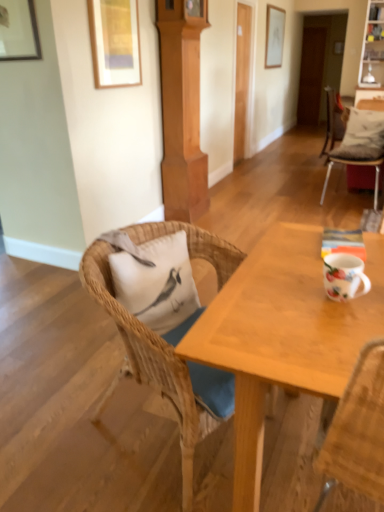
How much space does white cushioned chair at right, which is counted as the second chair, starting from the left, occupy horizontally?

24.19 inches.

Find the location of a particular element. This screenshot has width=384, height=512. white cushioned chair at right, which is the 2th chair from front to back is located at coordinates pos(357,163).

Where is `white matte pillow at left, the first pillow positioned from the left`? This screenshot has width=384, height=512. white matte pillow at left, the first pillow positioned from the left is located at coordinates (157, 282).

In order to click on matte white picture frame at upper center, which is counted as the 3th picture frame, starting from the front in this screenshot , I will do `click(274, 36)`.

The width and height of the screenshot is (384, 512). What are the coordinates of `white glossy mug at right` in the screenshot? It's located at (344, 276).

This screenshot has width=384, height=512. I want to click on white cushioned chair at right, the first chair positioned from the back, so click(x=357, y=163).

Considering the relative sizes of woven wood chair at center, positioned as the second chair in top-to-bottom order, and white glossy mug at right in the image provided, is woven wood chair at center, positioned as the second chair in top-to-bottom order, smaller than white glossy mug at right?

Incorrect, woven wood chair at center, positioned as the second chair in top-to-bottom order, is not smaller in size than white glossy mug at right.

From a real-world perspective, which chair is the 2nd one underneath the white glossy mug at right? Please provide its 2D coordinates.

[(164, 364)]

Does point (233, 255) come in front of point (342, 253)?

No.

From the image's perspective, is matte white picture frame at upper center, the third picture frame when ordered from bottom to top, above or below white fabric pillow at upper right, which appears as the second pillow when viewed from the front?

Clearly, from the image's perspective, matte white picture frame at upper center, the third picture frame when ordered from bottom to top, is above white fabric pillow at upper right, which appears as the second pillow when viewed from the front.

In the scene shown: Is there a large distance between matte white picture frame at upper center, which is counted as the 3th picture frame, starting from the front, and white fabric pillow at upper right, the second pillow positioned from the left?

Yes.

From a real-world perspective, between matte white picture frame at upper center, which ranks as the 3th picture frame in left-to-right order, and white fabric pillow at upper right, the second pillow positioned from the left, who is vertically lower?

In real-world perspective, white fabric pillow at upper right, the second pillow positioned from the left, is lower.

How much distance is there between matte white picture frame at upper center, which ranks as the 3th picture frame in left-to-right order, and white fabric pillow at upper right, placed as the 2th pillow when sorted from bottom to top?

10.44 feet.

Can we say white fabric pillow at upper right, which is counted as the first pillow, starting from the right, lies outside wooden picture frame at upper left, the 3th picture frame in the top-to-bottom sequence?

Yes, white fabric pillow at upper right, which is counted as the first pillow, starting from the right, is located beyond the bounds of wooden picture frame at upper left, the 3th picture frame in the top-to-bottom sequence.

Considering the sizes of white fabric pillow at upper right, which is counted as the first pillow, starting from the right, and wooden picture frame at upper left, acting as the first picture frame starting from the bottom, in the image, is white fabric pillow at upper right, which is counted as the first pillow, starting from the right, wider or thinner than wooden picture frame at upper left, acting as the first picture frame starting from the bottom,?

Clearly, white fabric pillow at upper right, which is counted as the first pillow, starting from the right, has more width compared to wooden picture frame at upper left, acting as the first picture frame starting from the bottom.

Is white fabric pillow at upper right, positioned as the 1th pillow in top-to-bottom order, looking in the opposite direction of wooden picture frame at upper left, acting as the first picture frame starting from the bottom?

white fabric pillow at upper right, positioned as the 1th pillow in top-to-bottom order, is not turned away from wooden picture frame at upper left, acting as the first picture frame starting from the bottom.

From a real-world perspective, which object rests below the other?

white fabric pillow at upper right, which appears as the second pillow when viewed from the front, is physically lower.

Is there a large distance between matte wooden picture frame at upper left, which is the second picture frame from left to right, and white cushioned chair at right, the first chair when ordered from right to left?

Yes, matte wooden picture frame at upper left, which is the second picture frame from left to right, is far from white cushioned chair at right, the first chair when ordered from right to left.

From the image's perspective, who appears lower, matte wooden picture frame at upper left, arranged as the second picture frame when viewed from the right, or white cushioned chair at right, which is the 2th chair from front to back?

From the image's view, white cushioned chair at right, which is the 2th chair from front to back, is below.

Would you say white cushioned chair at right, which is counted as the 2th chair, starting from the bottom, is part of matte wooden picture frame at upper left, the 2th picture frame viewed from the top,'s contents?

No, matte wooden picture frame at upper left, the 2th picture frame viewed from the top, does not contain white cushioned chair at right, which is counted as the 2th chair, starting from the bottom.

Does matte wooden picture frame at upper left, arranged as the second picture frame when viewed from the right, appear on the left side of white fabric pillow at upper right, positioned as the 1th pillow in top-to-bottom order?

Indeed, matte wooden picture frame at upper left, arranged as the second picture frame when viewed from the right, is positioned on the left side of white fabric pillow at upper right, positioned as the 1th pillow in top-to-bottom order.

How far apart are matte wooden picture frame at upper left, arranged as the 2th picture frame when viewed from the front, and white fabric pillow at upper right, placed as the 2th pillow when sorted from bottom to top?

matte wooden picture frame at upper left, arranged as the 2th picture frame when viewed from the front, and white fabric pillow at upper right, placed as the 2th pillow when sorted from bottom to top, are 7.05 feet apart from each other.

Is matte wooden picture frame at upper left, arranged as the second picture frame when viewed from the right, beside white fabric pillow at upper right, which appears as the second pillow when viewed from the front?

No, matte wooden picture frame at upper left, arranged as the second picture frame when viewed from the right, is not in contact with white fabric pillow at upper right, which appears as the second pillow when viewed from the front.

Is matte wooden picture frame at upper left, arranged as the second picture frame when viewed from the right, facing away from white fabric pillow at upper right, which is counted as the first pillow, starting from the right?

No, matte wooden picture frame at upper left, arranged as the second picture frame when viewed from the right, is not facing away from white fabric pillow at upper right, which is counted as the first pillow, starting from the right.

In the scene shown: Is white matte pillow at left, the first pillow positioned from the left, smaller than woven wood chair at center, which is the 1th chair in left-to-right order?

Correct, white matte pillow at left, the first pillow positioned from the left, occupies less space than woven wood chair at center, which is the 1th chair in left-to-right order.

Which is farther, (122, 296) or (213, 369)?

Point (122, 296)

From a real-world perspective, which pillow is the 1st one above the woven wood chair at center, which ranks as the 2th chair in back-to-front order? Please provide its 2D coordinates.

[(157, 282)]

Who is taller, white matte pillow at left, the first pillow viewed from the front, or woven wood chair at center, which ranks as the second chair in right-to-left order?

Standing taller between the two is woven wood chair at center, which ranks as the second chair in right-to-left order.

Consider the image. Based on their sizes in the image, would you say white fabric pillow at upper right, placed as the 2th pillow when sorted from bottom to top, is bigger or smaller than matte white picture frame at upper center, which ranks as the 3th picture frame in left-to-right order?

white fabric pillow at upper right, placed as the 2th pillow when sorted from bottom to top, is bigger than matte white picture frame at upper center, which ranks as the 3th picture frame in left-to-right order.

Which object is further away from the camera, white fabric pillow at upper right, placed as the 2th pillow when sorted from bottom to top, or matte white picture frame at upper center, which is counted as the 1th picture frame, starting from the back?

matte white picture frame at upper center, which is counted as the 1th picture frame, starting from the back.

How different are the orientations of white fabric pillow at upper right, which appears as the second pillow when viewed from the front, and matte white picture frame at upper center, which ranks as the 3th picture frame in left-to-right order, in degrees?

white fabric pillow at upper right, which appears as the second pillow when viewed from the front, and matte white picture frame at upper center, which ranks as the 3th picture frame in left-to-right order, are facing 107 degrees away from each other.

Could you tell me if white fabric pillow at upper right, the second pillow positioned from the left, is facing matte white picture frame at upper center, the 1th picture frame in the top-to-bottom sequence?

No, white fabric pillow at upper right, the second pillow positioned from the left, is not oriented towards matte white picture frame at upper center, the 1th picture frame in the top-to-bottom sequence.

Locate an element on the screen. The height and width of the screenshot is (512, 384). chair located on the left of white glossy mug at right is located at coordinates (164, 364).

Find the location of a particular element. The height and width of the screenshot is (512, 384). pillow on the right of matte white picture frame at upper center, which is counted as the 1th picture frame, starting from the back is located at coordinates [362, 135].

Looking at the image, which one is located further to wooden picture frame at upper left, the 3th picture frame in the top-to-bottom sequence, matte white picture frame at upper center, which is counted as the 1th picture frame, starting from the back, or white glossy mug at right?

matte white picture frame at upper center, which is counted as the 1th picture frame, starting from the back, lies further to wooden picture frame at upper left, the 3th picture frame in the top-to-bottom sequence, than the other object.

When comparing their distances from white fabric pillow at upper right, which is counted as the first pillow, starting from the right, does white glossy mug at right or woven wood chair at center, positioned as the second chair in top-to-bottom order, seem closer?

woven wood chair at center, positioned as the second chair in top-to-bottom order, is closer to white fabric pillow at upper right, which is counted as the first pillow, starting from the right.

Based on their spatial positions, is woven wood chair at center, arranged as the first chair when viewed from the front, or white matte pillow at left, the first pillow positioned from the left, further from matte wooden picture frame at upper left, arranged as the second picture frame when viewed from the right?

woven wood chair at center, arranged as the first chair when viewed from the front, lies further to matte wooden picture frame at upper left, arranged as the second picture frame when viewed from the right, than the other object.

From the image, which object appears to be nearer to white glossy mug at right, white fabric pillow at upper right, positioned as the 1th pillow in top-to-bottom order, or wooden picture frame at upper left, positioned as the first picture frame in front-to-back order?

wooden picture frame at upper left, positioned as the first picture frame in front-to-back order.

From the image, which object appears to be farther from wooden picture frame at upper left, the 3th picture frame in the right-to-left sequence, white glossy mug at right or white cushioned chair at right, which is the 2th chair from front to back?

white cushioned chair at right, which is the 2th chair from front to back, is further to wooden picture frame at upper left, the 3th picture frame in the right-to-left sequence.

When comparing their distances from matte wooden picture frame at upper left, acting as the second picture frame starting from the bottom, does woven wood chair at center, the 1th chair when ordered from bottom to top, or white fabric pillow at upper right, which appears as the second pillow when viewed from the front, seem closer?

The object closer to matte wooden picture frame at upper left, acting as the second picture frame starting from the bottom, is woven wood chair at center, the 1th chair when ordered from bottom to top.

Which object lies nearer to the anchor point white matte pillow at left, acting as the second pillow starting from the top, matte wooden picture frame at upper left, the 2th picture frame viewed from the top, or woven wood chair at center, the 1th chair when ordered from bottom to top?

woven wood chair at center, the 1th chair when ordered from bottom to top.

When comparing their distances from white glossy mug at right, does white matte pillow at left, acting as the 2th pillow starting from the back, or white fabric pillow at upper right, positioned as the 1th pillow in top-to-bottom order, seem closer?

white matte pillow at left, acting as the 2th pillow starting from the back.

The width and height of the screenshot is (384, 512). Find the location of `chair between woven wood chair at center, which is the 1th chair in left-to-right order, and white fabric pillow at upper right, the second pillow positioned from the left, along the z-axis`. chair between woven wood chair at center, which is the 1th chair in left-to-right order, and white fabric pillow at upper right, the second pillow positioned from the left, along the z-axis is located at coordinates (357, 163).

You are a GUI agent. You are given a task and a screenshot of the screen. Output one action in this format:
    pyautogui.click(x=<x>, y=<y>)
    Task: Click on the pillow located between matte wooden picture frame at upper left, which is the second picture frame from left to right, and white cushioned chair at right, the first chair when ordered from right to left, in the left-right direction
    The image size is (384, 512).
    Given the screenshot: What is the action you would take?
    pyautogui.click(x=157, y=282)

What are the coordinates of `picture frame between matte wooden picture frame at upper left, which is the second picture frame from left to right, and white matte pillow at left, which ranks as the 1th pillow in bottom-to-top order, in the vertical direction` in the screenshot? It's located at (18, 31).

The height and width of the screenshot is (512, 384). In order to click on picture frame positioned between wooden picture frame at upper left, the 3th picture frame in the right-to-left sequence, and matte white picture frame at upper center, which is counted as the 1th picture frame, starting from the back, from near to far in this screenshot , I will do pos(115,42).